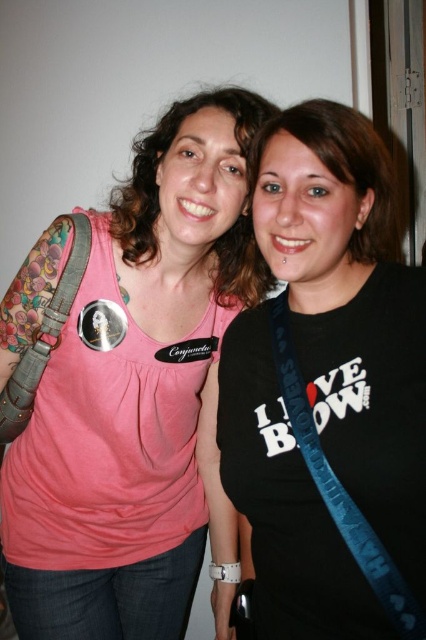
You are a photographer adjusting the lighting for a group photo. You need to ensure that the pink fabric tank top at center and the blue fabric strap at right are both well lit. Given their distance apart, can you estimate whether the lighting setup will require moving the lights closer or farther away to evenly illuminate both objects?

The pink fabric tank top at center is 36.51 centimeters from the blue fabric strap at right. To evenly illuminate both objects, the lighting setup should be positioned at a distance that accounts for their separation. Since they are relatively close, the lights can likely remain at a moderate distance to cover both without needing extreme adjustments. However, precise placement would depend on the specific light intensity and spread.